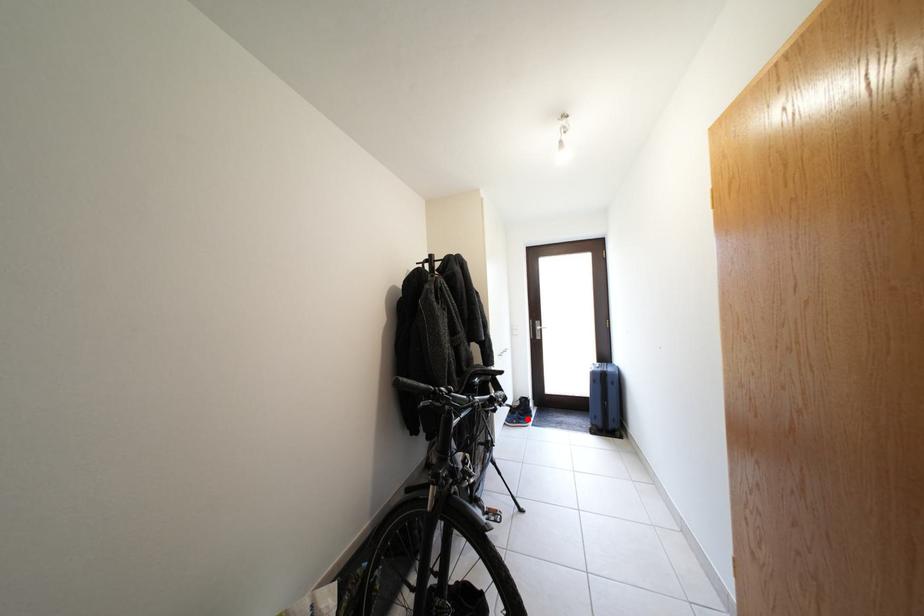
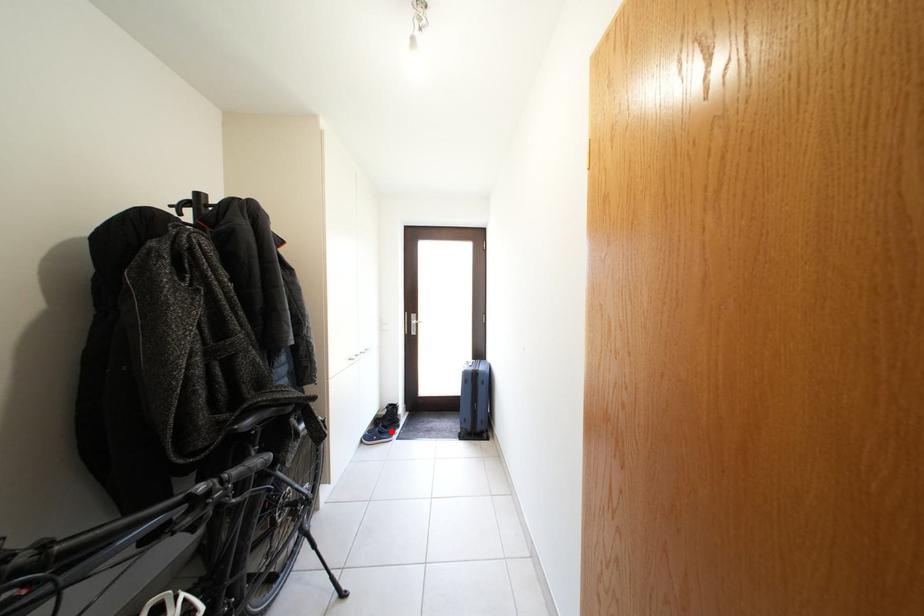
I am providing you with two images of the same scene from different viewpoints. A red point is marked on the first image and another point is marked on the second image. Does the point marked in image1 correspond to the same location as the one in image2?

Yes